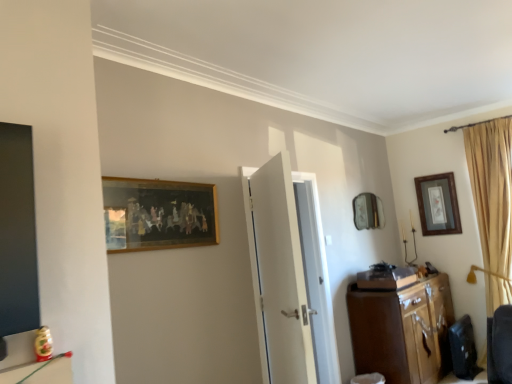
Question: Is wooden framed artwork at upper left, placed as the 2th picture frame when sorted from back to front, positioned before wooden cabinet at right?

Choices:
 (A) no
 (B) yes

Answer: (B)

Question: Does wooden framed artwork at upper left, placed as the 2th picture frame when sorted from back to front, have a greater height compared to wooden cabinet at right?

Choices:
 (A) no
 (B) yes

Answer: (A)

Question: From the image's perspective, is wooden framed artwork at upper left, the second picture frame when ordered from right to left, beneath wooden cabinet at right?

Choices:
 (A) no
 (B) yes

Answer: (A)

Question: Considering the relative positions of wooden framed artwork at upper left, placed as the 2th picture frame when sorted from back to front, and wooden cabinet at right in the image provided, is wooden framed artwork at upper left, placed as the 2th picture frame when sorted from back to front, to the right of wooden cabinet at right from the viewer's perspective?

Choices:
 (A) no
 (B) yes

Answer: (A)

Question: Is wooden framed artwork at upper left, placed as the first picture frame when sorted from front to back, to the left of wooden cabinet at right from the viewer's perspective?

Choices:
 (A) yes
 (B) no

Answer: (A)

Question: Is wooden cabinet at right located within wooden framed artwork at upper left, the second picture frame when ordered from right to left?

Choices:
 (A) no
 (B) yes

Answer: (A)

Question: Does wooden framed artwork at upper left, the second picture frame when ordered from right to left, have a greater width compared to wooden picture frame at upper right, which appears as the first picture frame when viewed from the right?

Choices:
 (A) yes
 (B) no

Answer: (A)

Question: Does wooden framed artwork at upper left, which is the first picture frame from left to right, have a lesser height compared to wooden picture frame at upper right, which is the second picture frame in left-to-right order?

Choices:
 (A) no
 (B) yes

Answer: (B)

Question: From the image's perspective, is wooden framed artwork at upper left, which is the first picture frame from left to right, located above wooden picture frame at upper right, which is the second picture frame in left-to-right order?

Choices:
 (A) yes
 (B) no

Answer: (A)

Question: Is wooden framed artwork at upper left, placed as the 2th picture frame when sorted from back to front, positioned beyond the bounds of wooden picture frame at upper right, which is the second picture frame in left-to-right order?

Choices:
 (A) yes
 (B) no

Answer: (A)

Question: Is wooden framed artwork at upper left, placed as the first picture frame when sorted from front to back, oriented away from wooden picture frame at upper right, the first picture frame positioned from the back?

Choices:
 (A) no
 (B) yes

Answer: (A)

Question: Does wooden framed artwork at upper left, placed as the first picture frame when sorted from front to back, have a lesser width compared to wooden picture frame at upper right, the first picture frame positioned from the back?

Choices:
 (A) yes
 (B) no

Answer: (B)

Question: Is wooden picture frame at upper right, marked as the second picture frame in a front-to-back arrangement, thinner than wooden cabinet at right?

Choices:
 (A) yes
 (B) no

Answer: (A)